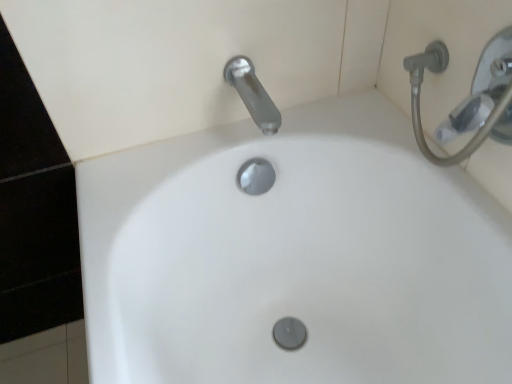
Question: Considering the relative positions of white glossy sink at center and satin nickel faucet at upper center in the image provided, is white glossy sink at center to the right of satin nickel faucet at upper center from the viewer's perspective?

Choices:
 (A) no
 (B) yes

Answer: (B)

Question: From the image's perspective, would you say white glossy sink at center is shown under satin nickel faucet at upper center?

Choices:
 (A) yes
 (B) no

Answer: (A)

Question: Is white glossy sink at center to the left of satin nickel faucet at upper center from the viewer's perspective?

Choices:
 (A) no
 (B) yes

Answer: (A)

Question: Considering the relative sizes of white glossy sink at center and satin nickel faucet at upper center in the image provided, is white glossy sink at center wider than satin nickel faucet at upper center?

Choices:
 (A) no
 (B) yes

Answer: (B)

Question: Considering the relative sizes of white glossy sink at center and satin nickel faucet at upper center in the image provided, is white glossy sink at center thinner than satin nickel faucet at upper center?

Choices:
 (A) yes
 (B) no

Answer: (B)

Question: Is the position of white glossy sink at center less distant than that of satin nickel faucet at upper center?

Choices:
 (A) no
 (B) yes

Answer: (B)

Question: Is white glossy sink at center located within silver metallic shower head at upper right?

Choices:
 (A) yes
 (B) no

Answer: (B)

Question: Is silver metallic shower head at upper right in contact with white glossy sink at center?

Choices:
 (A) yes
 (B) no

Answer: (B)

Question: Is silver metallic shower head at upper right closer to camera compared to white glossy sink at center?

Choices:
 (A) yes
 (B) no

Answer: (B)

Question: From the image's perspective, is silver metallic shower head at upper right on top of white glossy sink at center?

Choices:
 (A) no
 (B) yes

Answer: (B)

Question: From a real-world perspective, is silver metallic shower head at upper right located beneath white glossy sink at center?

Choices:
 (A) yes
 (B) no

Answer: (B)

Question: Is silver metallic shower head at upper right not near white glossy sink at center?

Choices:
 (A) yes
 (B) no

Answer: (B)

Question: From a real-world perspective, is satin nickel faucet at upper center physically above silver metallic shower head at upper right?

Choices:
 (A) no
 (B) yes

Answer: (A)